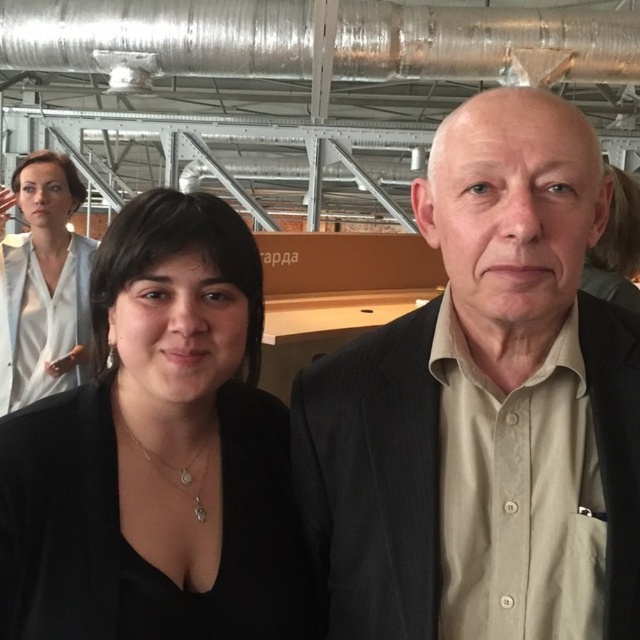
You are standing at the point with coordinates point (20, 360) and want to move towards the point with coordinates point (225, 483). Will you have to walk past the older man in the dark suit jacket to reach your destination?

Point (225, 483) is in front of point (20, 360), so yes, you will have to walk past the older man in the dark suit jacket to reach point (225, 483).

You are a photographer setting up a shot in this industrial space. You need to place two markers at the coordinates point (x=323, y=486) and point (x=38, y=401). Which marker should you place first if you want to start with the one closer to the camera?

You should place the marker at point (x=38, y=401) first because it is closer to the camera than point (x=323, y=486), which is further away.

You are a photographer setting up for a group photo in the industrial space. You notice two people wearing shirts at the center of the frame. The beige cotton shirt at center and the black matte shirt at center. You want to ensure both are in focus. Since the camera can only focus on one subject at a time, which shirt should you focus on to prioritize the closer subject?

The beige cotton shirt at center is closer to the viewer than the black matte shirt at center, so you should focus on the beige cotton shirt at center to prioritize the closer subject.